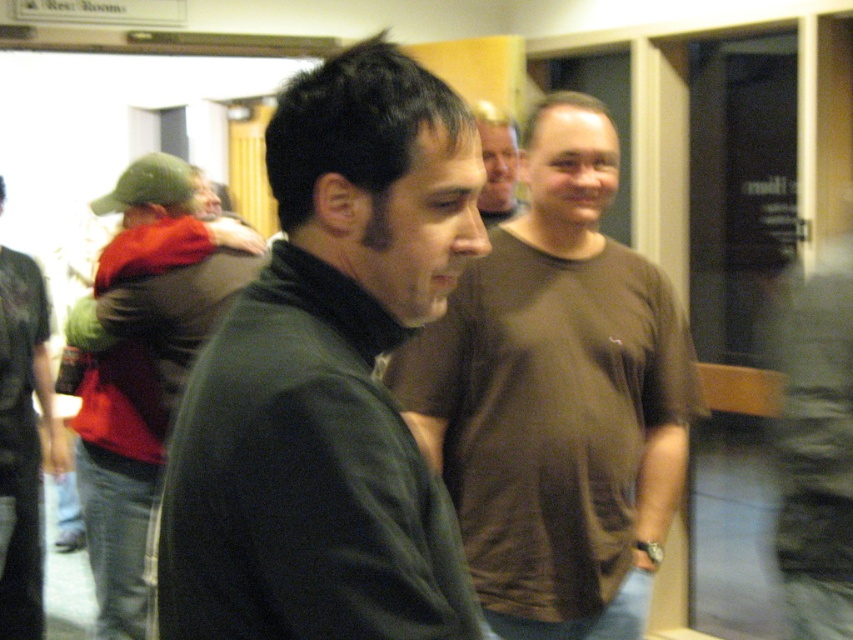
Between brown cotton shirt at center and green fabric cap at left, which one is positioned higher?

brown cotton shirt at center

Which is below, brown cotton shirt at center or green fabric cap at left?

green fabric cap at left is lower down.

Who is more distant from viewer, [546,586] or [117,410]?

The point [117,410] is behind.

This screenshot has width=853, height=640. I want to click on brown cotton shirt at center, so 556,397.

Who is positioned more to the right, green fabric cap at left or dark gray sweater at left?

green fabric cap at left is more to the right.

Can you confirm if green fabric cap at left is positioned below dark gray sweater at left?

No, green fabric cap at left is not below dark gray sweater at left.

Does point (143, 556) come farther from viewer compared to point (25, 579)?

No, (143, 556) is in front of (25, 579).

Locate an element on the screen. The width and height of the screenshot is (853, 640). green fabric cap at left is located at coordinates (143, 362).

The width and height of the screenshot is (853, 640). What do you see at coordinates (328, 380) in the screenshot? I see `dark green sweater at center` at bounding box center [328, 380].

Who is more forward, (222, 564) or (486, 198)?

Positioned in front is point (222, 564).

Identify the location of dark green sweater at center. Image resolution: width=853 pixels, height=640 pixels. (328, 380).